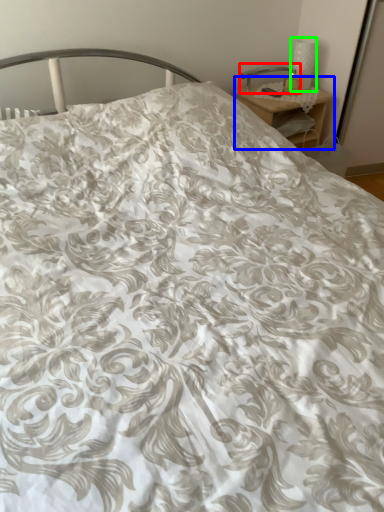
Question: Which object is the farthest from table lamp (highlighted by a red box)? Choose among these: nightstand (highlighted by a blue box) or table lamp (highlighted by a green box).

Choices:
 (A) nightstand
 (B) table lamp

Answer: (A)